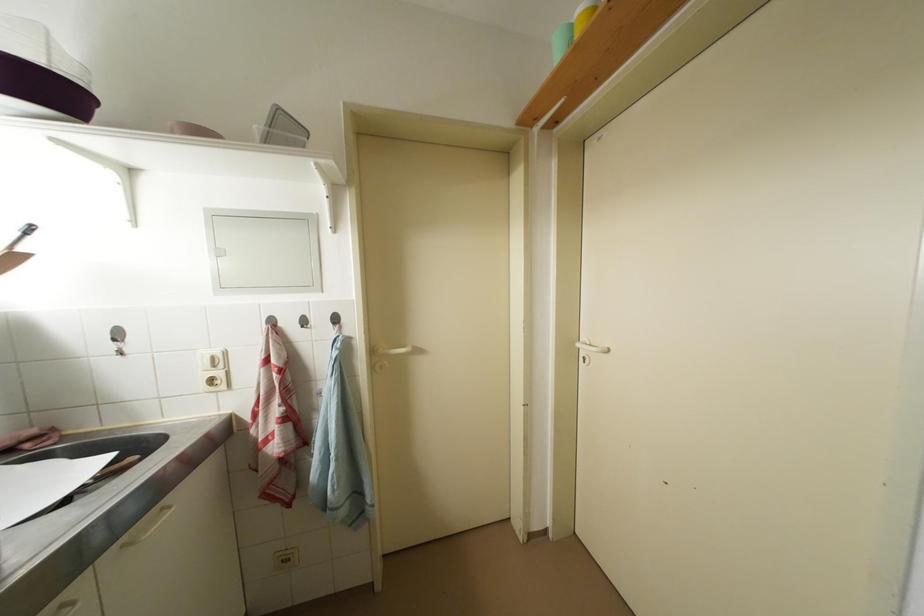
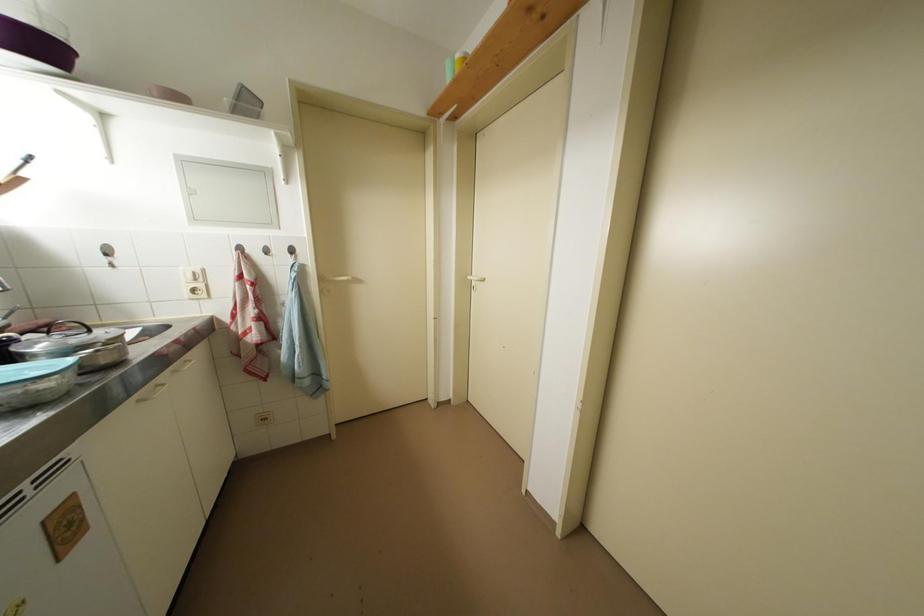
The point at (220, 362) is marked in the first image. Where is the corresponding point in the second image?

(201, 277)